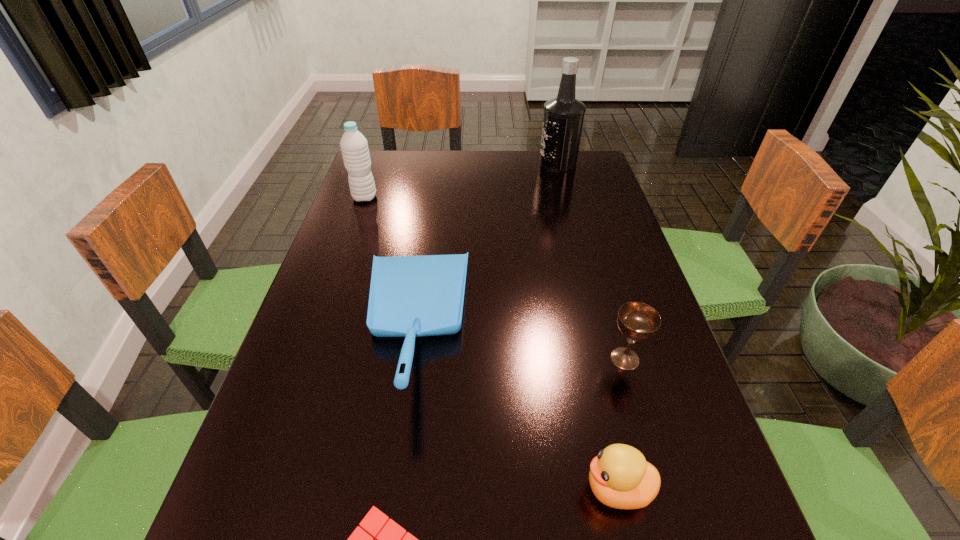
I want to click on empty space between the water bottle and the chalice, so click(494, 278).

This screenshot has width=960, height=540. Find the location of `vacant area between the liquor and the fifth tallest object`. vacant area between the liquor and the fifth tallest object is located at coordinates (588, 326).

I want to click on free space between the dustpan and the chalice, so tap(518, 342).

Locate an element on the screen. free space between the dustpan and the duckling is located at coordinates (515, 407).

Identify the location of free area in between the fifth farthest object and the chalice. This screenshot has width=960, height=540. (621, 423).

Locate which object is the closest to the farthest object. Please provide its 2D coordinates. Your answer should be formatted as a tuple, i.e. [(x, y)], where the tuple contains the x and y coordinates of a point satisfying the conditions above.

[(410, 296)]

Where is `the closest object to the shortest object`? The height and width of the screenshot is (540, 960). the closest object to the shortest object is located at coordinates (410, 296).

At what (x,y) coordinates should I click in order to perform the action: click on vacant region that satisfies the following two spatial constraints: 1. on the front side of the chalice; 2. on the face of the duckling. Please return your answer as a coordinate pair (x, y). Looking at the image, I should click on (663, 489).

Find the location of a particular element. free region that satisfies the following two spatial constraints: 1. on the front side of the chalice; 2. on the face of the second nearest object is located at coordinates (663, 489).